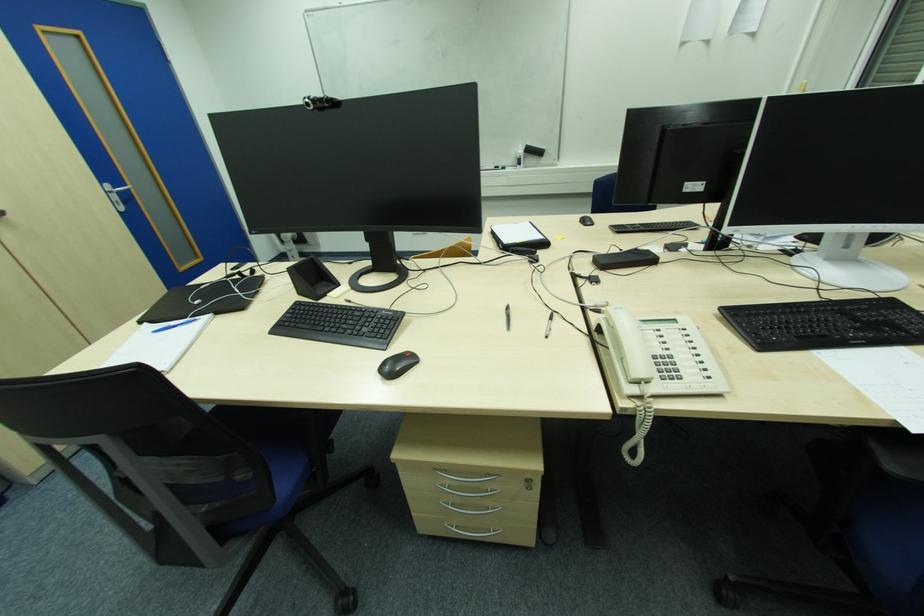
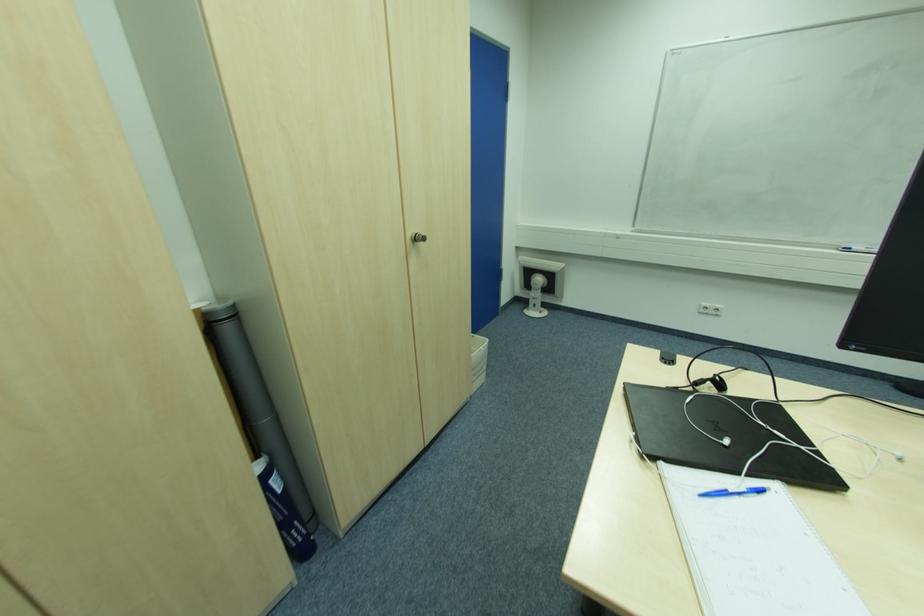
Locate, in the second image, the point that corresponds to (x=175, y=328) in the first image.

(727, 493)